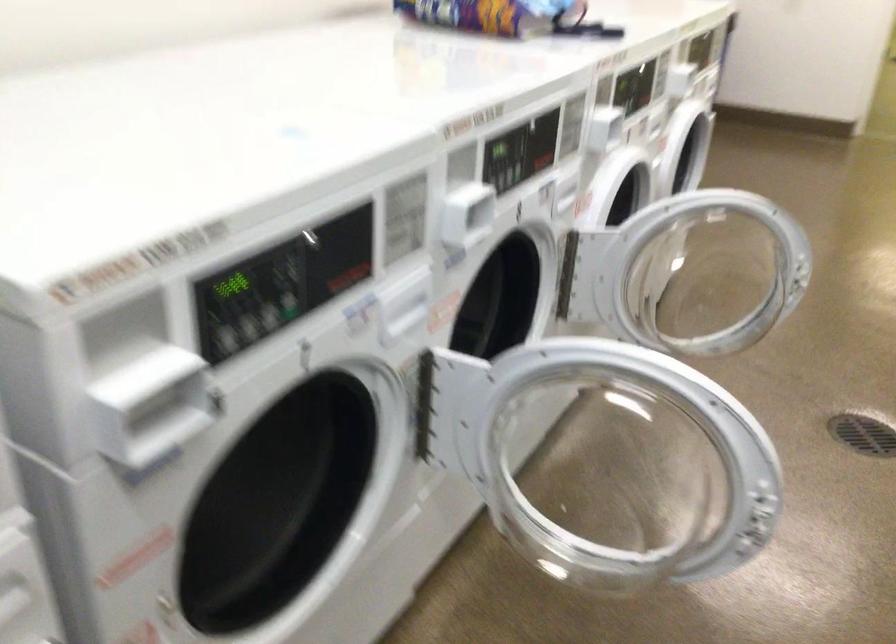
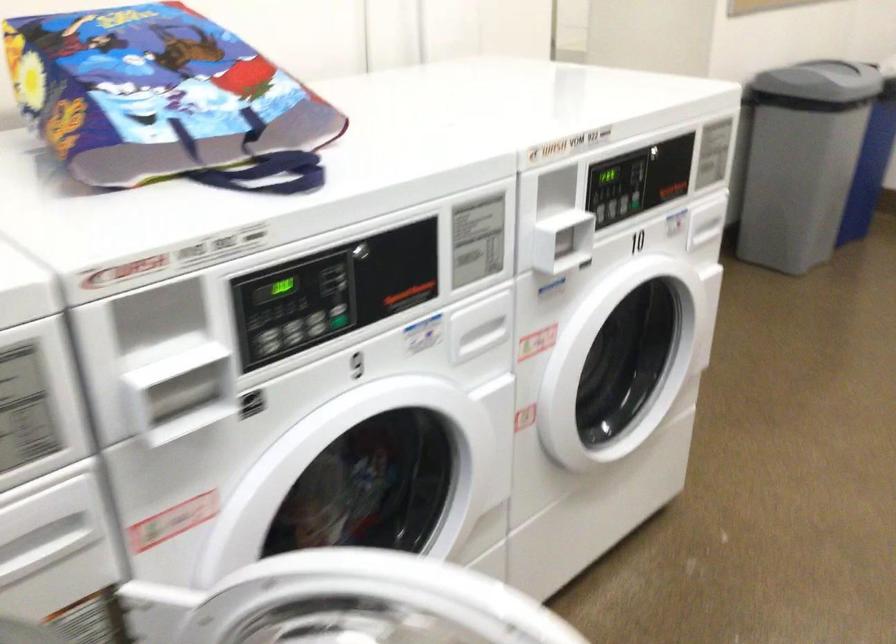
The images are taken continuously from a first-person perspective. In which direction are you moving?

The cameraman walked toward right, forward.